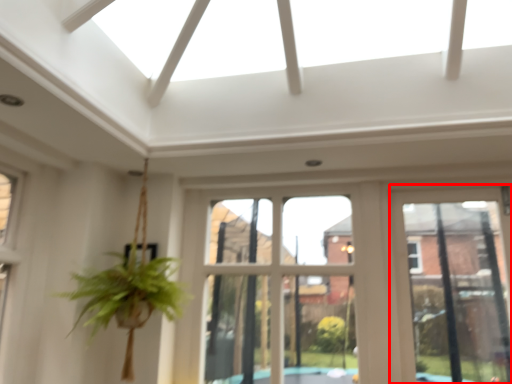
Question: From the image's perspective, what is the correct spatial relationship of window frame (annotated by the red box) in relation to bay window?

Choices:
 (A) below
 (B) above

Answer: (A)